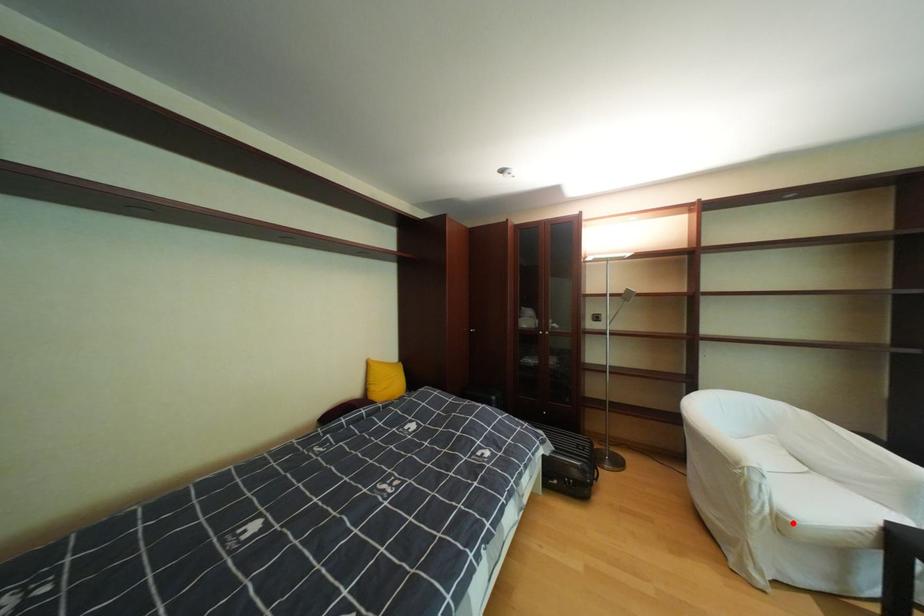
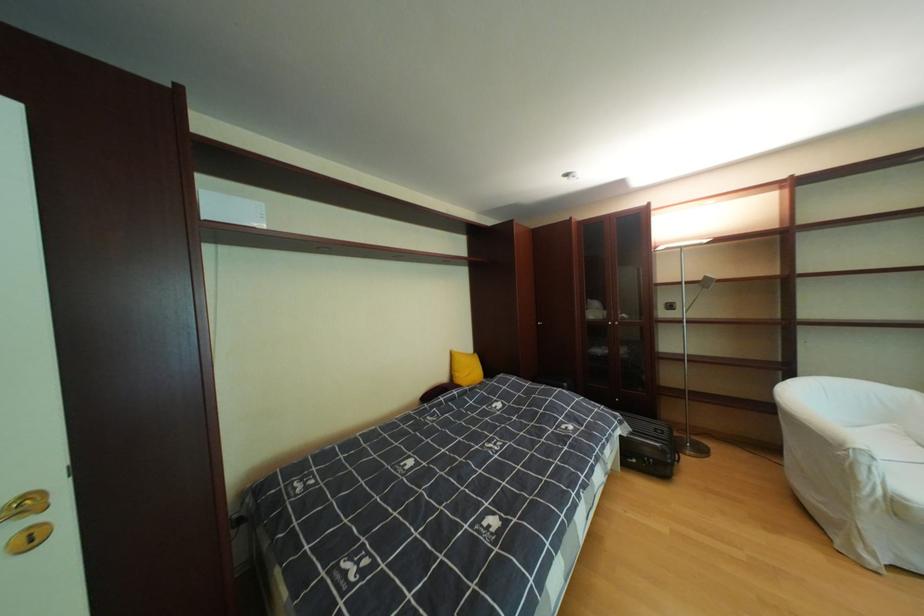
In the second image, find the point that corresponds to the highlighted location in the first image.

(908, 506)